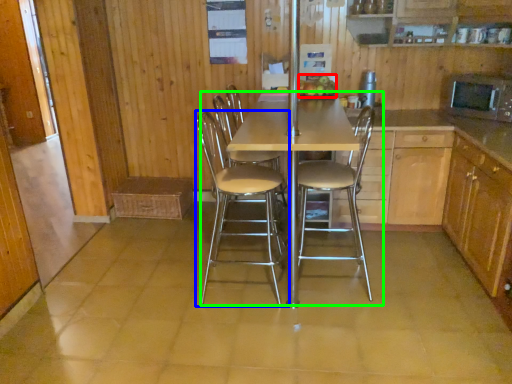
Question: Which object is the closest to the fruit (highlighted by a red box)? Choose among these: chair (highlighted by a blue box) or kitchen & dining room table (highlighted by a green box).

Choices:
 (A) chair
 (B) kitchen & dining room table

Answer: (B)